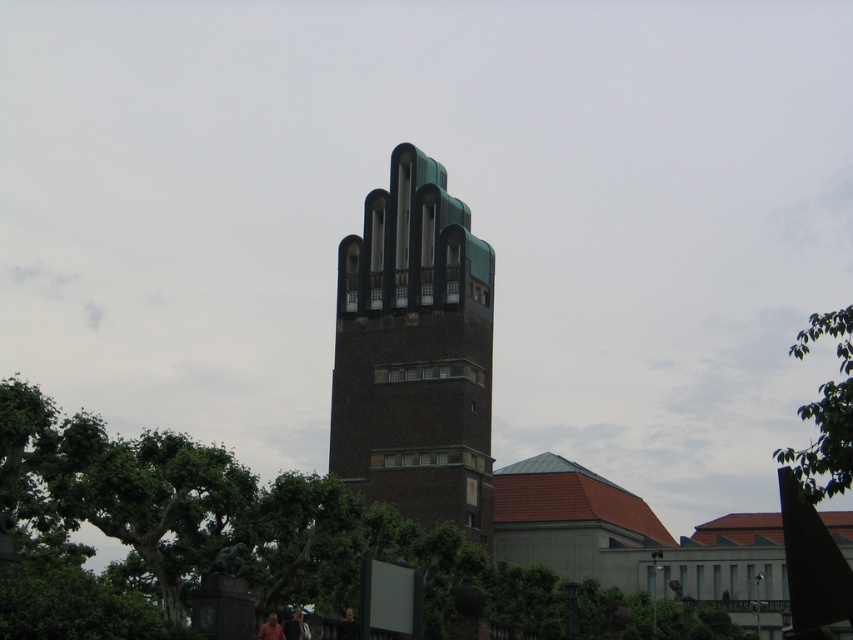
In the scene shown: You are standing in a park and see the green leafy tree at center and the brown brick tower at center. Which object is taller?

The brown brick tower at center is taller than the green leafy tree at center.